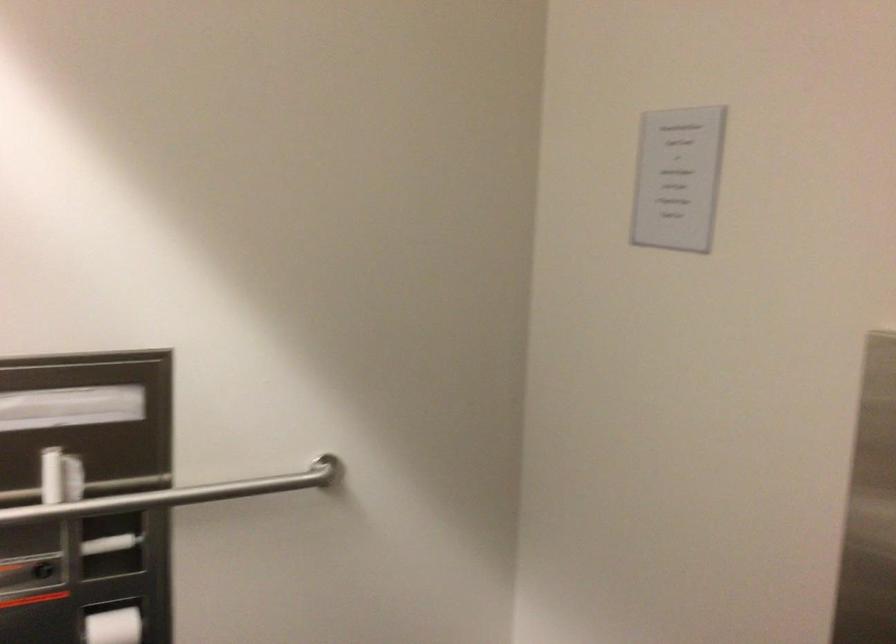
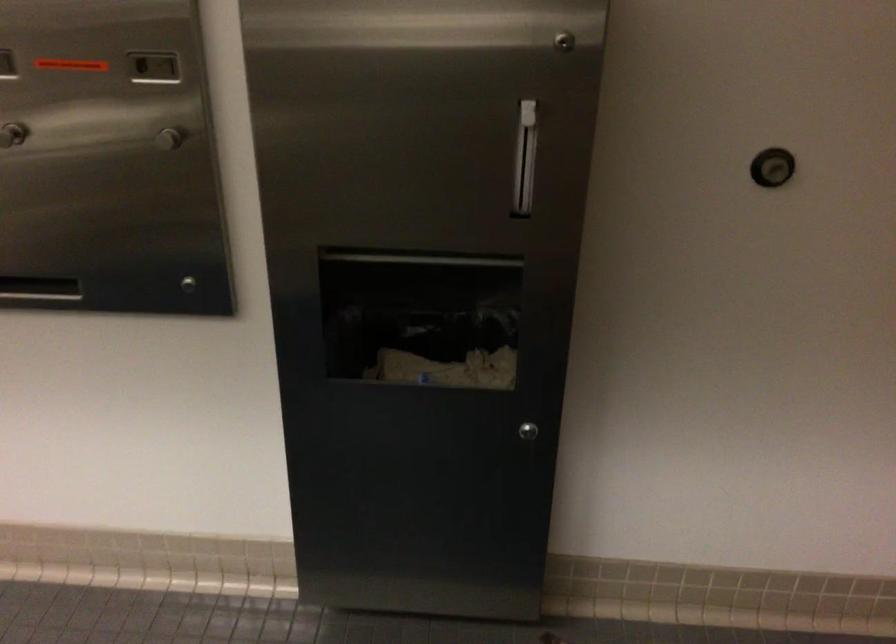
The images are taken continuously from a first-person perspective. In which direction is your viewpoint rotating?

The camera's rotation is toward right-down.